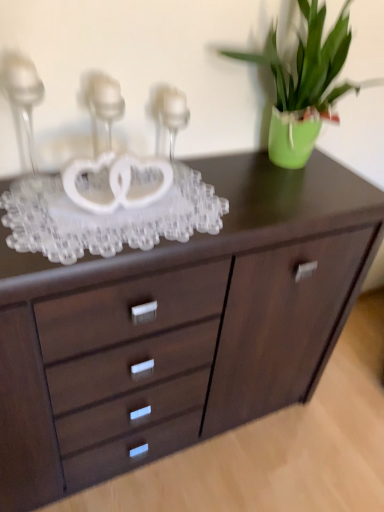
Where is `free space in front of clear glass candle holder at upper left, acting as the first candle holder starting from the left`? free space in front of clear glass candle holder at upper left, acting as the first candle holder starting from the left is located at coordinates (37, 218).